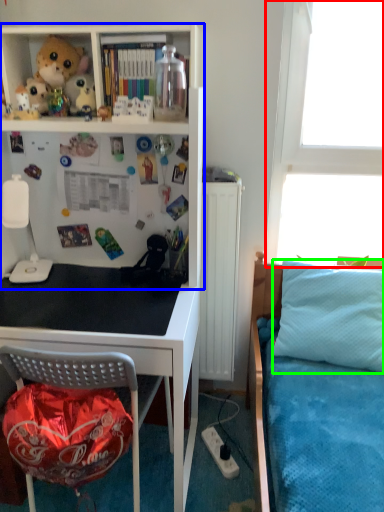
Question: Which object is positioned farthest from window screen (highlighted by a red box)? Select from shelf (highlighted by a blue box) and pillow (highlighted by a green box).

Choices:
 (A) shelf
 (B) pillow

Answer: (A)